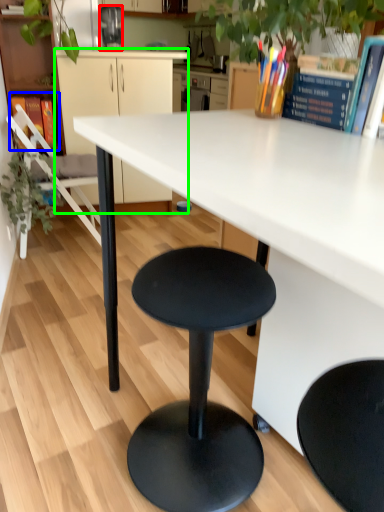
Question: Estimate the real-world distances between objects in this image. Which object is closer to appliance (highlighted by a red box), book (highlighted by a blue box) or cabinetry (highlighted by a green box)?

Choices:
 (A) book
 (B) cabinetry

Answer: (B)